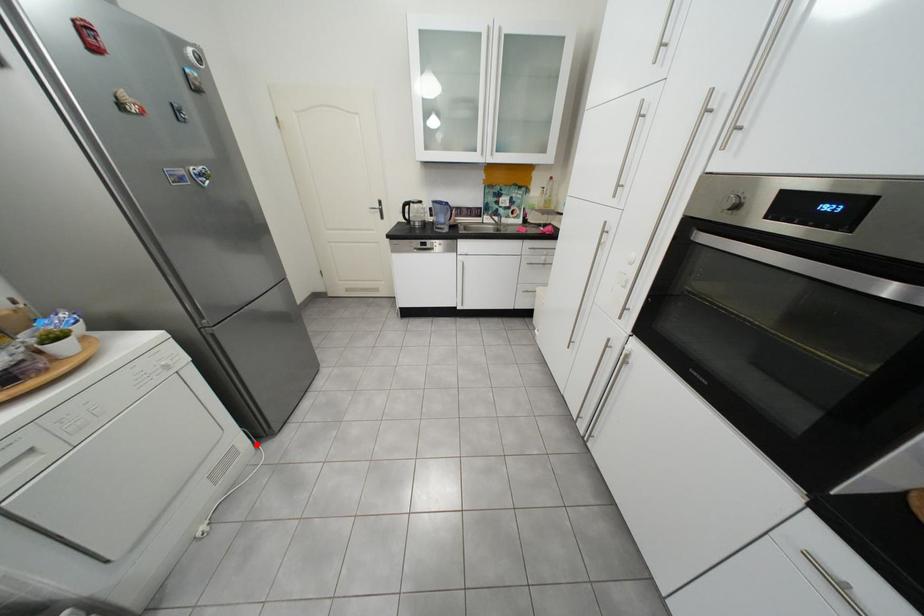
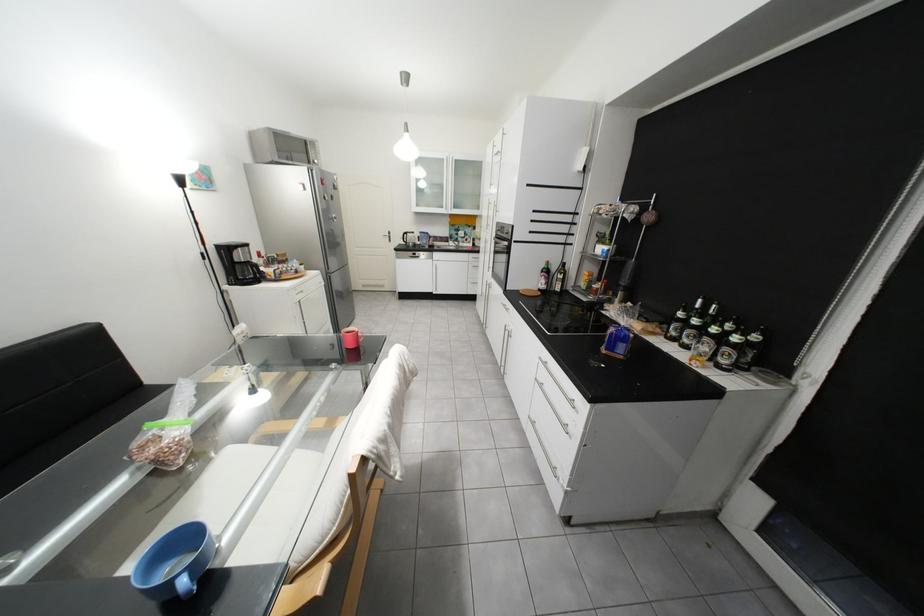
Question: I am providing you with two images of the same scene from different viewpoints. A red point is shown in image1. For the corresponding object point in image2, is it positioned nearer or farther from the camera?

Choices:
 (A) Nearer
 (B) Farther

Answer: (B)